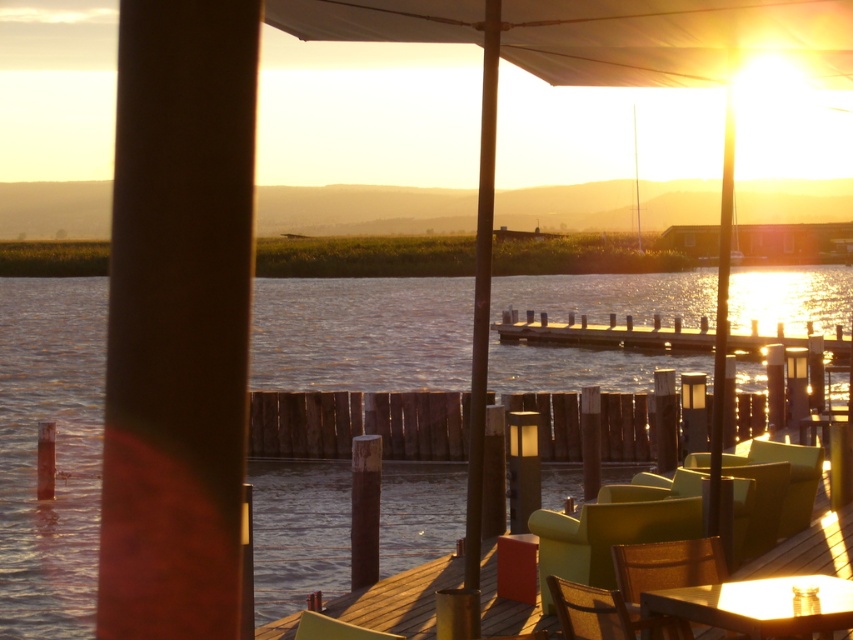
You are planning to place a new table on the deck. The table must be placed where it won t block the view of the shiny blue water at center. Considering the size of the matte green chair at lower right, where should you place the table?

The shiny blue water at center is larger in size than the matte green chair at lower right, so placing the table near the matte green chair at lower right would leave enough space to avoid blocking the view of the shiny blue water at center.